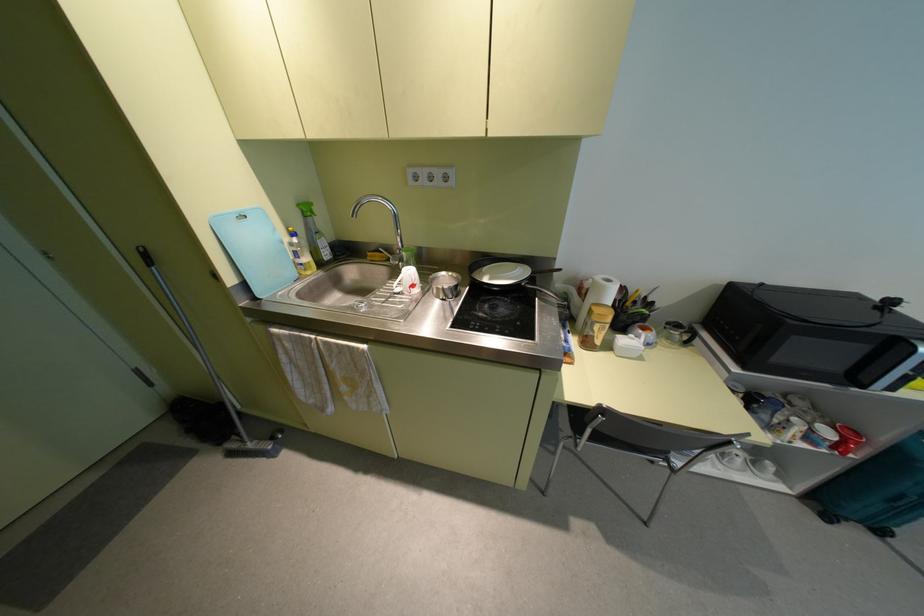
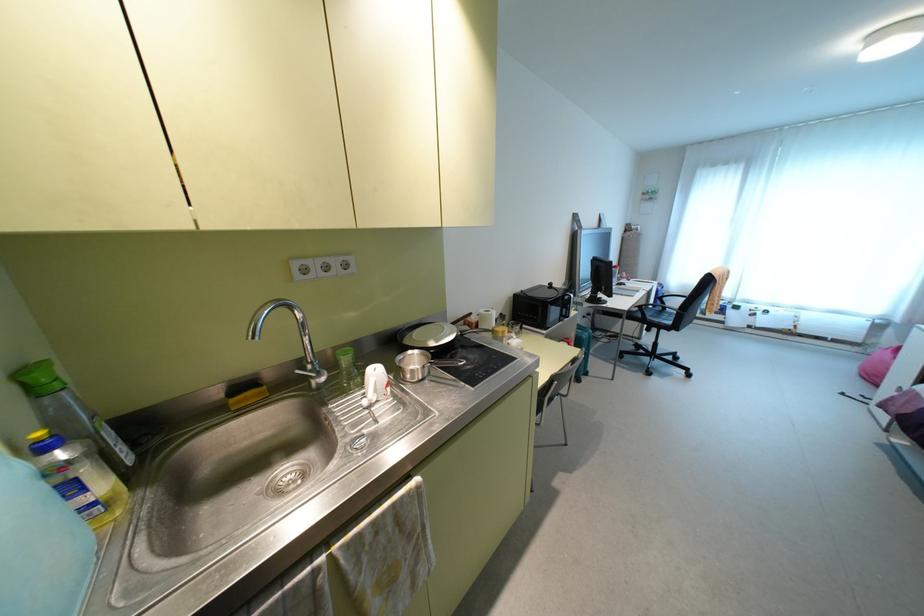
The point at [293,233] is marked in the first image. Where is the corresponding point in the second image?

(43, 447)